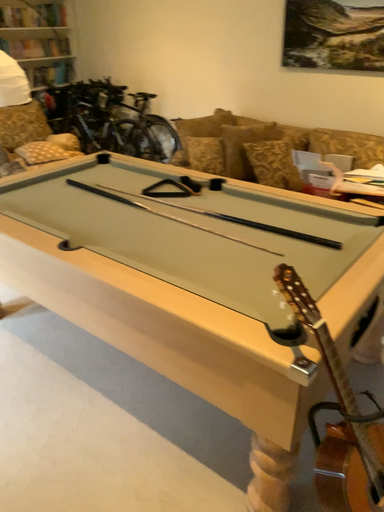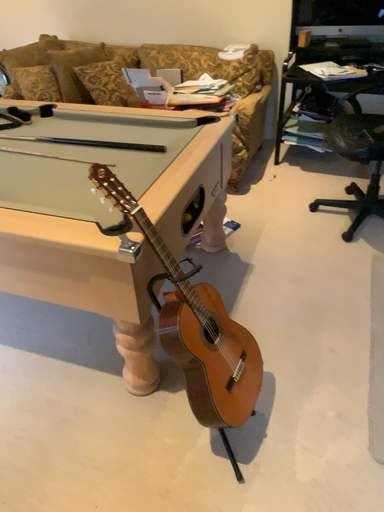
Question: Which way did the camera rotate in the video?

Choices:
 (A) rotated left
 (B) rotated right

Answer: (B)